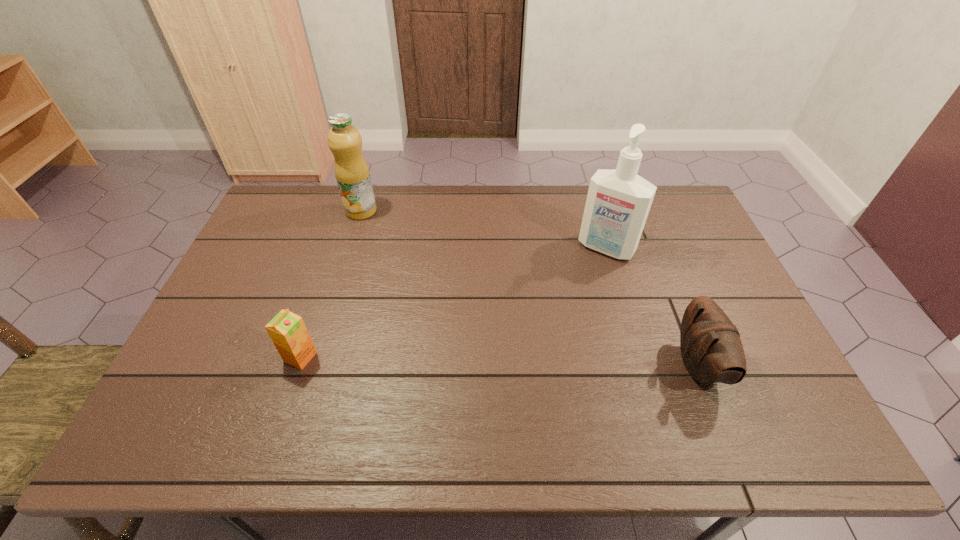
Locate an element on the screen. vacant space located 0.270m on the front label of the farthest object is located at coordinates pyautogui.click(x=395, y=268).

Image resolution: width=960 pixels, height=540 pixels. In order to click on free region located on the front label of the tallest object in this screenshot , I will do `click(538, 349)`.

Find the location of a particular element. Image resolution: width=960 pixels, height=540 pixels. free spot located 0.060m on the front label of the tallest object is located at coordinates (588, 272).

Locate an element on the screen. The width and height of the screenshot is (960, 540). vacant area situated on the front label of the tallest object is located at coordinates (542, 341).

The height and width of the screenshot is (540, 960). What are the coordinates of `object that is positioned at the far edge` in the screenshot? It's located at (351, 170).

Locate an element on the screen. object situated at the near edge is located at coordinates (712, 352).

The height and width of the screenshot is (540, 960). Identify the location of object positioned at the right edge. (712, 352).

The image size is (960, 540). Identify the location of object that is positioned at the near right corner. (712, 352).

In the image, there is a desktop. Where is `vacant area at the far edge`? vacant area at the far edge is located at coordinates (452, 205).

The width and height of the screenshot is (960, 540). Identify the location of vacant space at the near edge of the desktop. (706, 395).